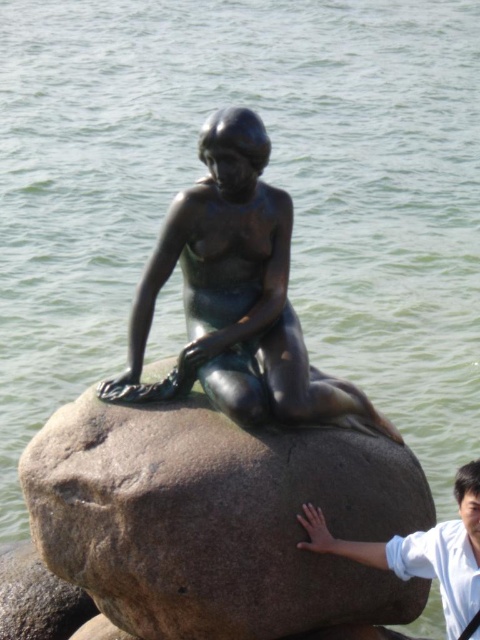
You are standing in front of the bronze mermaid statue. You notice two points marked on the statue. The first point is at coordinates point [466,518] and the second is at point [44,602]. If you were to draw a straight line between these two points, would the line pass in front of or behind the statue?

The line between point [466,518] and point [44,602] would pass in front of the statue because point [466,518] is in front of point [44,602].

You are standing at a point 36.39 meters away from the point marked at coordinates (x=305, y=589) in the image. If you want to approach the bronze statue of a mermaid seated on the rock, which direction should you move relative to the point?

Since the point at (x=305, y=589) is 36.39 meters away from you, you should move towards that point to reach the bronze statue of a mermaid seated on the rock.